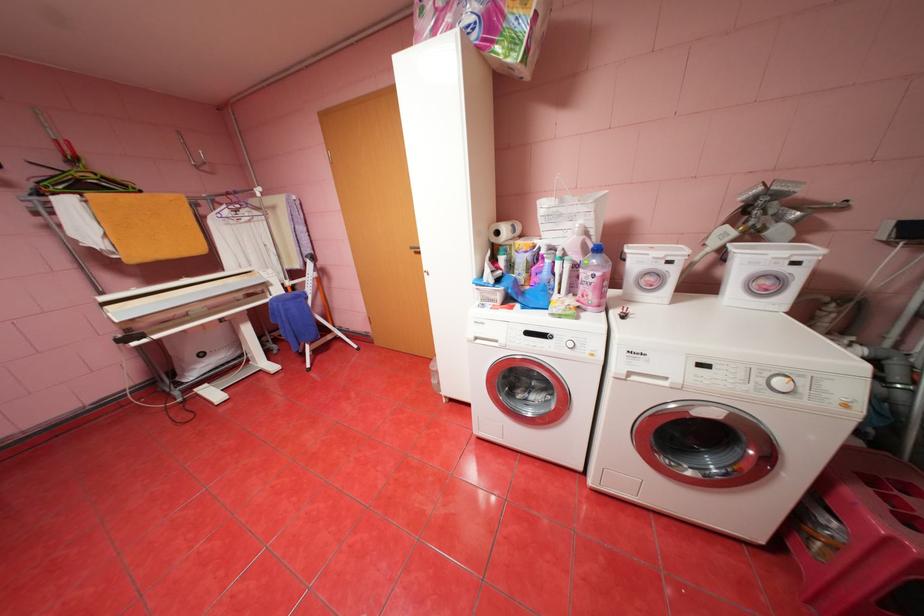
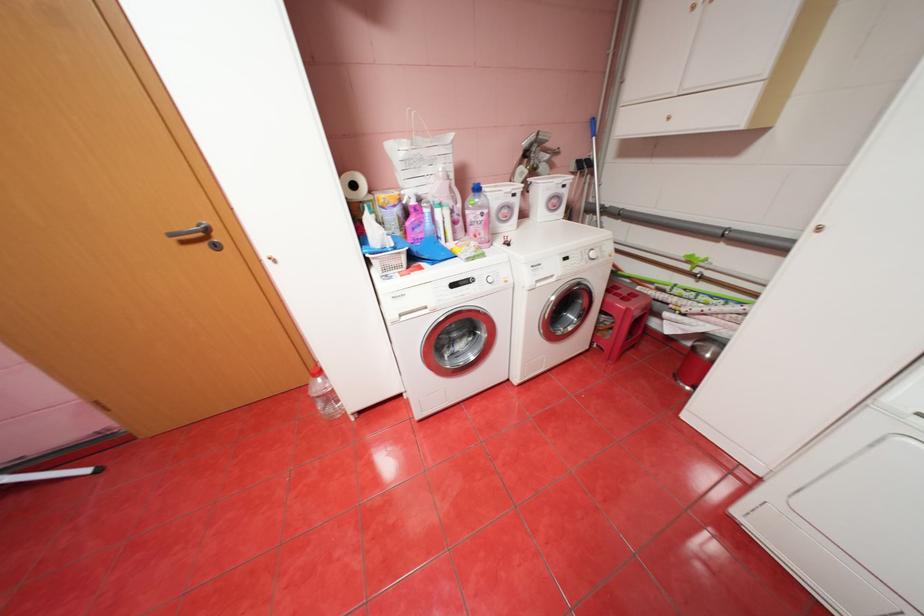
Where in the second image is the point corresponding to [579,344] from the first image?

(499, 280)